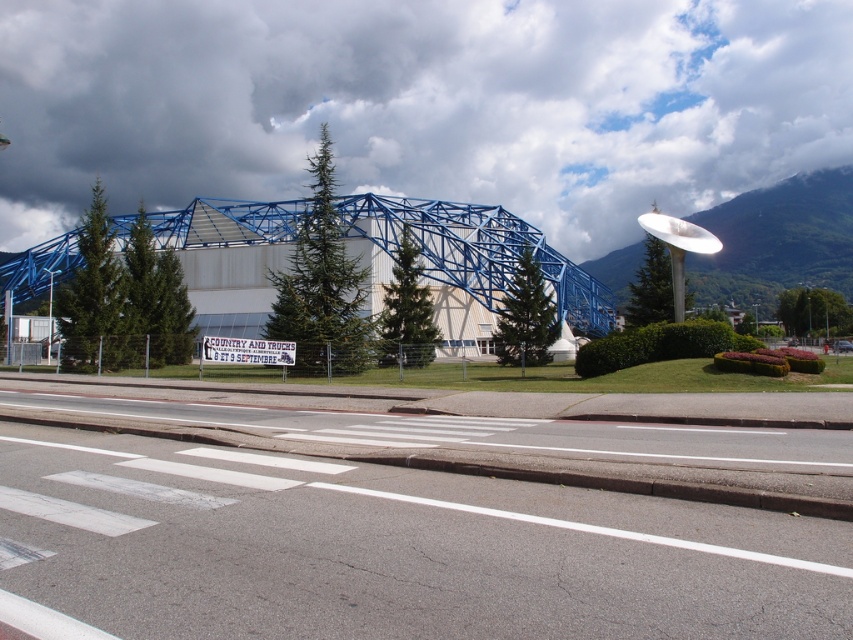
Question: Is white matte structure at upper center closer to camera compared to blue metallic structure at center?

Choices:
 (A) no
 (B) yes

Answer: (A)

Question: Which point is farther to the camera?

Choices:
 (A) (763, 218)
 (B) (674, 54)

Answer: (B)

Question: Is white matte structure at upper center positioned before white glossy mountain at upper center?

Choices:
 (A) yes
 (B) no

Answer: (B)

Question: In this image, where is blue metallic structure at center located relative to white glossy mountain at upper center?

Choices:
 (A) above
 (B) below

Answer: (A)

Question: Considering the real-world distances, which object is closest to the white glossy mountain at upper center?

Choices:
 (A) white matte structure at upper center
 (B) blue metallic structure at center

Answer: (B)

Question: Which point is closer to the camera?

Choices:
 (A) (573, 154)
 (B) (383, 218)

Answer: (B)